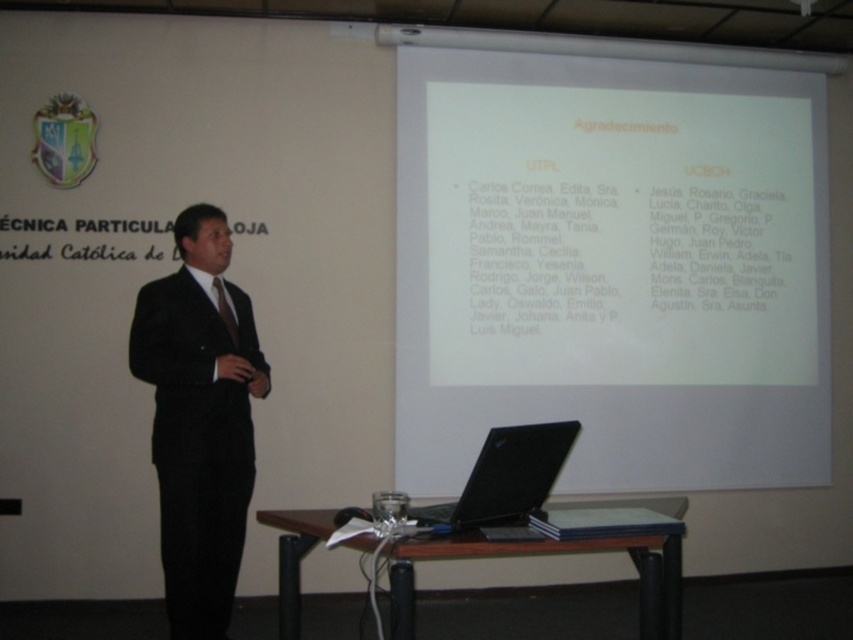
You are organizing a presentation and need to place a name tag on the table. The name tag is the same size as the black matte laptop at lower center. Can you fit it on the white paper at upper center without overlapping?

The white paper at upper center is larger in size than the black matte laptop at lower center, so the name tag can fit on the white paper at upper center without overlapping.

You are a presenter who needs to adjust the projector screen. The projector is connected to the black matte laptop at lower center. To reach the projector, you must walk from your current position at the point marked by the coordinates point (x=505, y=477). In which direction should you move relative to the laptop?

The point (x=505, y=477) indicates the black matte laptop at lower center. To reach the projector screen positioned above the table, you should move upward from the laptop.

You are a presenter who needs to adjust the position of the black matte laptop at lower center. Where exactly should you place it?

The black matte laptop at lower center should be placed at point (x=505, y=477).